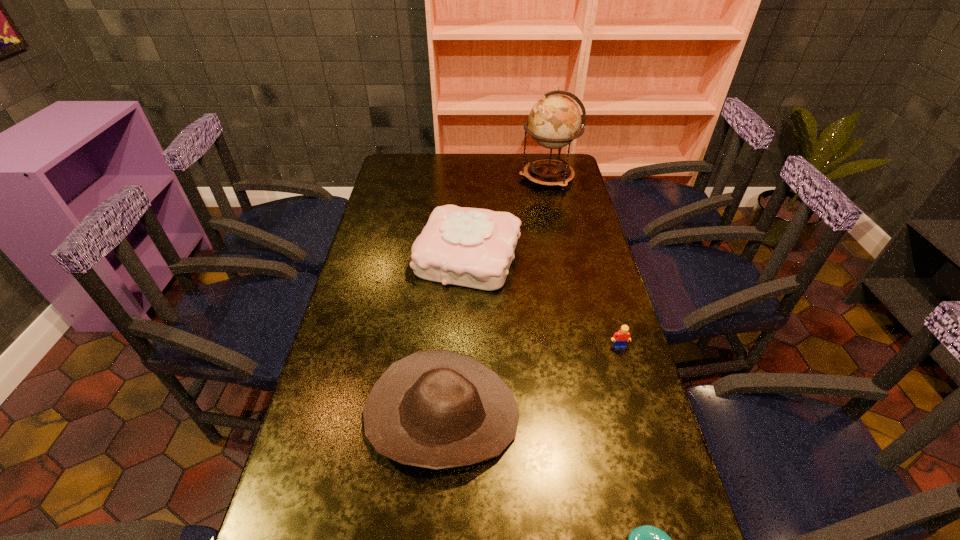
Image resolution: width=960 pixels, height=540 pixels. What are the coordinates of `blank space located on the right of the second nearest object` in the screenshot? It's located at (606, 416).

Locate an element on the screen. free point located 0.250m on the face of the third farthest object is located at coordinates (644, 434).

Locate an element on the screen. The width and height of the screenshot is (960, 540). object that is at the far edge is located at coordinates (554, 122).

Find the location of a particular element. object that is positioned at the left edge is located at coordinates (436, 409).

Where is `globe that is positioned at the right edge`? Image resolution: width=960 pixels, height=540 pixels. globe that is positioned at the right edge is located at coordinates (554, 122).

Identify the location of Lego situated at the right edge. The image size is (960, 540). (620, 338).

Identify the location of object present at the far right corner. The image size is (960, 540). (554, 122).

At what (x,y) coordinates should I click in order to perform the action: click on vacant region at the far edge of the desktop. Please return your answer as a coordinate pair (x, y). Looking at the image, I should click on (x=439, y=156).

At what (x,y) coordinates should I click in order to perform the action: click on vacant space at the left edge. Please return your answer as a coordinate pair (x, y). This screenshot has height=540, width=960. Looking at the image, I should click on (373, 338).

At what (x,y) coordinates should I click in order to perform the action: click on free spot at the right edge of the desktop. Please return your answer as a coordinate pair (x, y). The image size is (960, 540). Looking at the image, I should click on (632, 428).